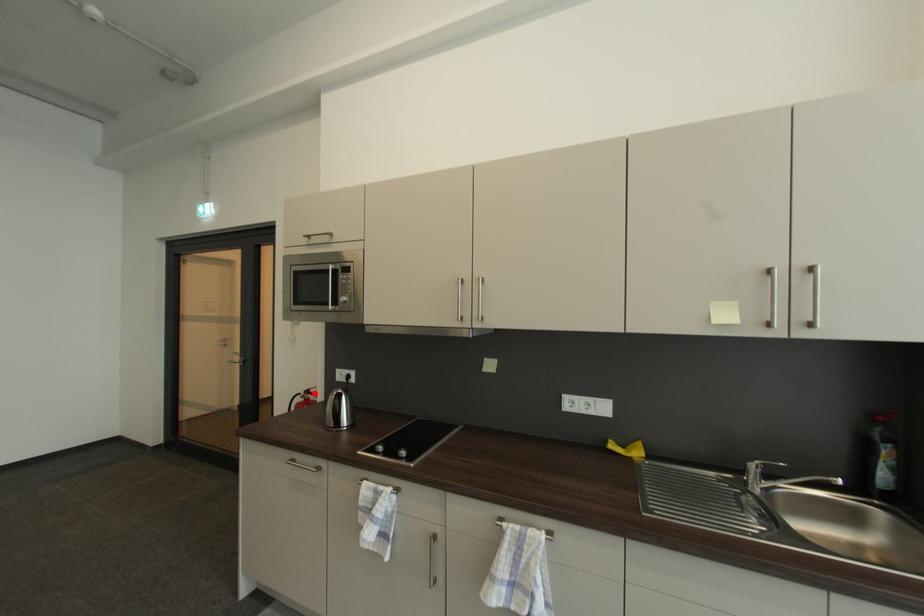
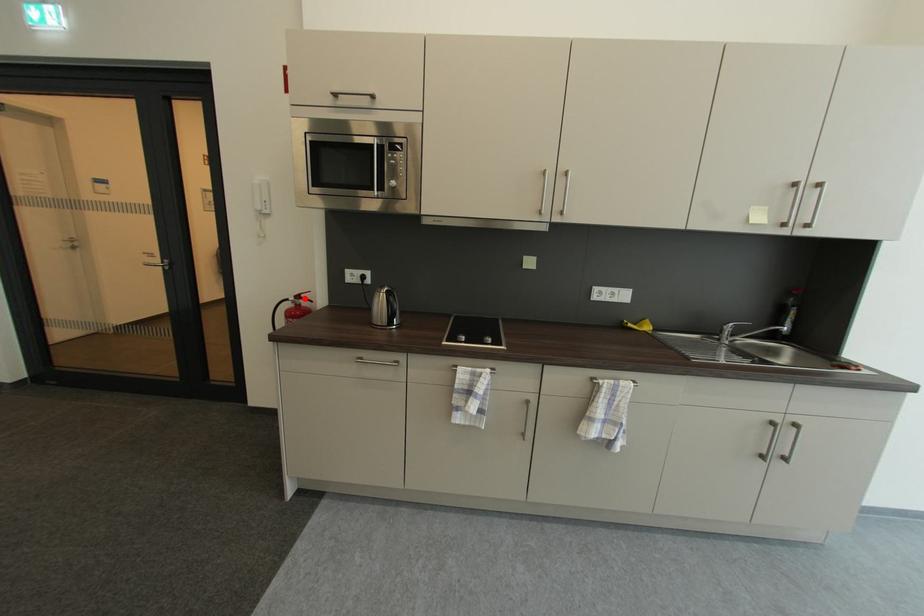
From the picture: I am providing you with two images of the same scene from different viewpoints. A red point is marked on the first image and another point is marked on the second image. Are the points marked in image1 and image2 representing the same 3D position?

Yes